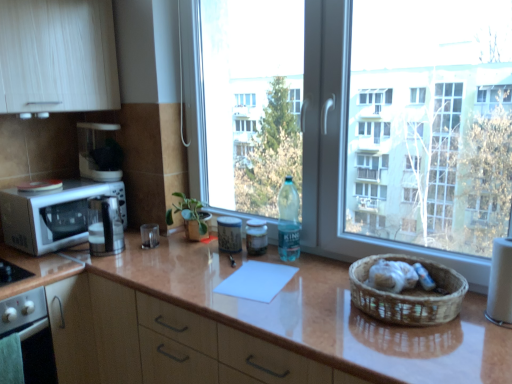
Identify the location of vacant space that's between white paper towel at right, the 4th appliance from the left, and brown woven basket at right. (478, 327).